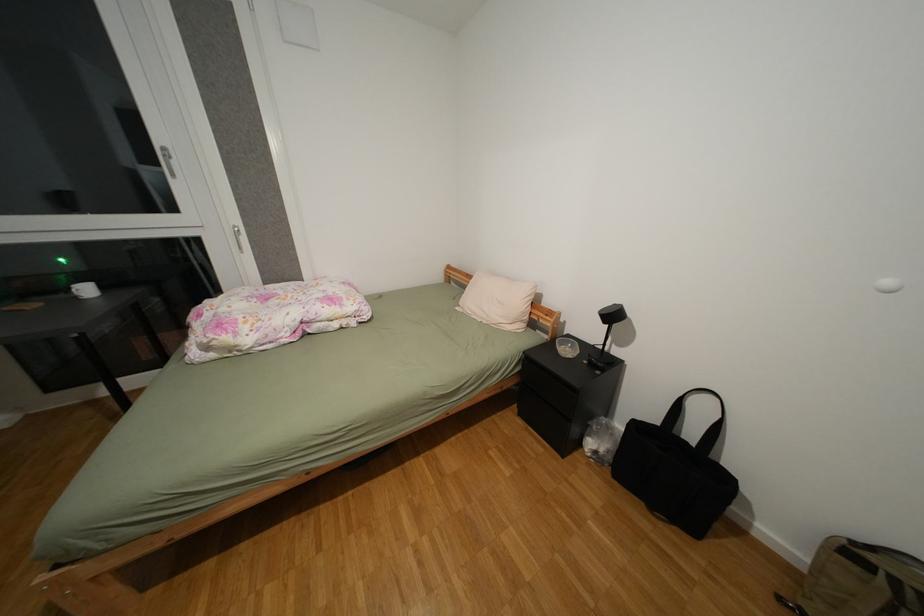
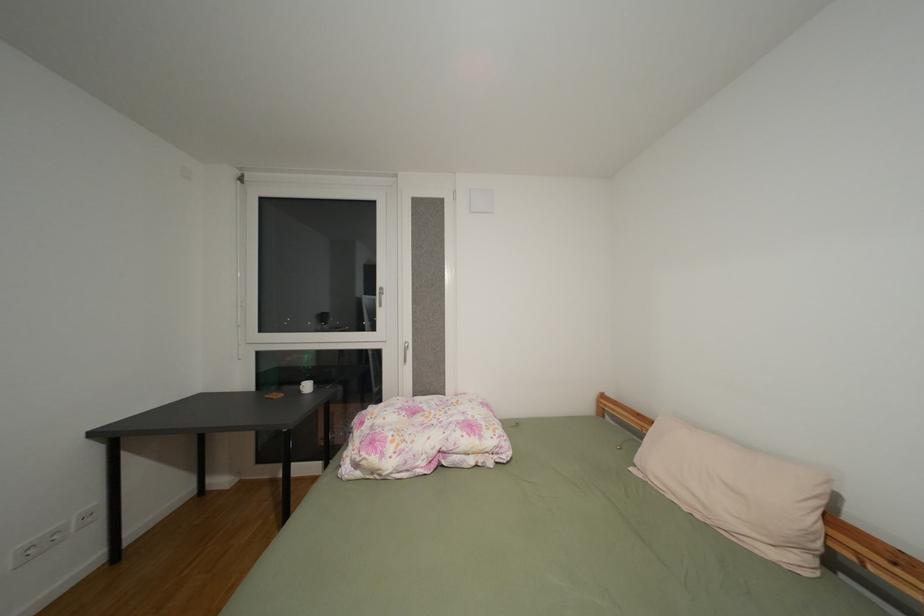
Consider the image. Based on the continuous images, in which direction is the camera rotating?

The camera's rotation is toward left-up.